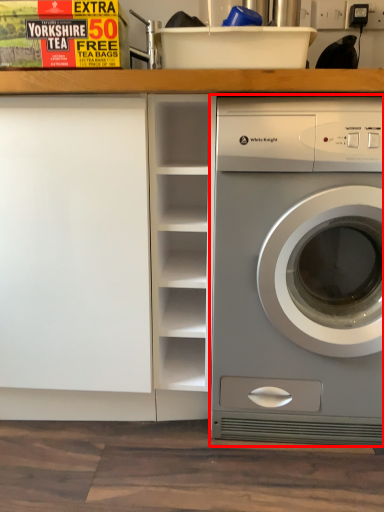
Question: From the image's perspective, where is washing machine (annotated by the red box) located in relation to bookshelf in the image?

Choices:
 (A) above
 (B) below

Answer: (B)